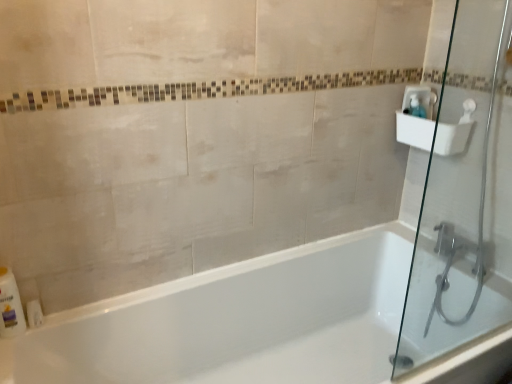
Question: From the image's perspective, does transparent glass shower door at right appear lower than white plastic bottle at lower left?

Choices:
 (A) yes
 (B) no

Answer: (B)

Question: Can you confirm if transparent glass shower door at right is taller than white plastic bottle at lower left?

Choices:
 (A) no
 (B) yes

Answer: (B)

Question: Does transparent glass shower door at right have a larger size compared to white plastic bottle at lower left?

Choices:
 (A) no
 (B) yes

Answer: (B)

Question: From a real-world perspective, is transparent glass shower door at right over white plastic bottle at lower left?

Choices:
 (A) yes
 (B) no

Answer: (A)

Question: Is transparent glass shower door at right shorter than white plastic bottle at lower left?

Choices:
 (A) yes
 (B) no

Answer: (B)

Question: Is transparent glass shower door at right to the left of white plastic bottle at lower left from the viewer's perspective?

Choices:
 (A) yes
 (B) no

Answer: (B)

Question: Considering the relative positions of transparent glass shower door at right and white glossy bathtub at center in the image provided, is transparent glass shower door at right to the right of white glossy bathtub at center from the viewer's perspective?

Choices:
 (A) no
 (B) yes

Answer: (B)

Question: Could you tell me if transparent glass shower door at right is turned towards white glossy bathtub at center?

Choices:
 (A) yes
 (B) no

Answer: (A)

Question: Is there a large distance between transparent glass shower door at right and white glossy bathtub at center?

Choices:
 (A) yes
 (B) no

Answer: (B)

Question: Can you confirm if transparent glass shower door at right is bigger than white glossy bathtub at center?

Choices:
 (A) no
 (B) yes

Answer: (A)

Question: Considering the relative positions of transparent glass shower door at right and white glossy bathtub at center in the image provided, is transparent glass shower door at right behind white glossy bathtub at center?

Choices:
 (A) no
 (B) yes

Answer: (B)

Question: Can white glossy bathtub at center be found inside transparent glass shower door at right?

Choices:
 (A) no
 (B) yes

Answer: (A)

Question: Can you confirm if white plastic sink at upper right is shorter than clear plastic soap dispenser at upper right?

Choices:
 (A) no
 (B) yes

Answer: (A)